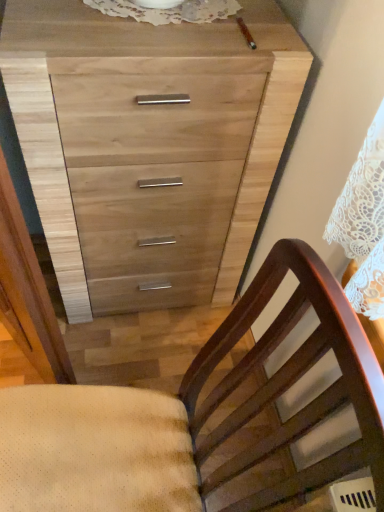
Question: In the image, is natural wood chest of drawers at upper center on the left side or the right side of brown wood chair at lower right?

Choices:
 (A) left
 (B) right

Answer: (B)

Question: Considering the positions of natural wood chest of drawers at upper center and brown wood chair at lower right in the image, is natural wood chest of drawers at upper center taller or shorter than brown wood chair at lower right?

Choices:
 (A) tall
 (B) short

Answer: (B)

Question: From the image's perspective, is natural wood chest of drawers at upper center positioned above or below brown wood chair at lower right?

Choices:
 (A) below
 (B) above

Answer: (B)

Question: Is point (19, 411) closer or farther from the camera than point (233, 28)?

Choices:
 (A) farther
 (B) closer

Answer: (B)

Question: Considering the relative positions of brown wood chair at lower right and natural wood chest of drawers at upper center in the image provided, is brown wood chair at lower right to the left or to the right of natural wood chest of drawers at upper center?

Choices:
 (A) left
 (B) right

Answer: (A)

Question: Considering the positions of brown wood chair at lower right and natural wood chest of drawers at upper center in the image, is brown wood chair at lower right taller or shorter than natural wood chest of drawers at upper center?

Choices:
 (A) short
 (B) tall

Answer: (B)

Question: Relative to natural wood chest of drawers at upper center, is brown wood chair at lower right in front or behind?

Choices:
 (A) behind
 (B) front

Answer: (B)